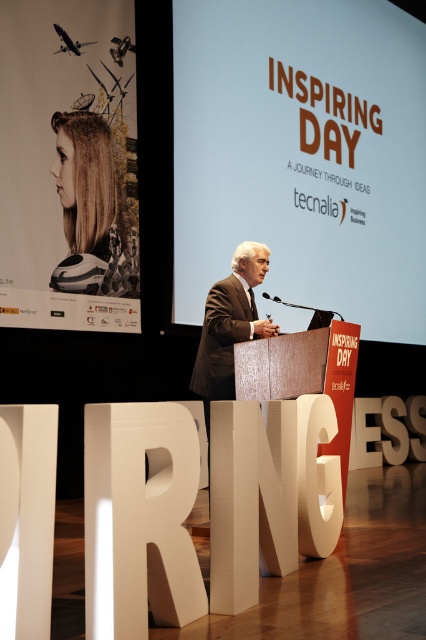
Question: Considering the real-world distances, which object is closest to the white matte projection screen at upper center?

Choices:
 (A) dark brown suit at center
 (B) matte white poster at upper center

Answer: (B)

Question: Which point is closer to the camera?

Choices:
 (A) (72, 150)
 (B) (325, 67)

Answer: (A)

Question: Is white matte projection screen at upper center further to camera compared to dark brown suit at center?

Choices:
 (A) no
 (B) yes

Answer: (B)

Question: Which point is farther to the camera?

Choices:
 (A) (204, 349)
 (B) (331, 269)

Answer: (B)

Question: Does matte white poster at upper center have a smaller size compared to dark brown suit at center?

Choices:
 (A) yes
 (B) no

Answer: (B)

Question: Does matte white poster at upper center appear on the left side of dark brown suit at center?

Choices:
 (A) yes
 (B) no

Answer: (A)